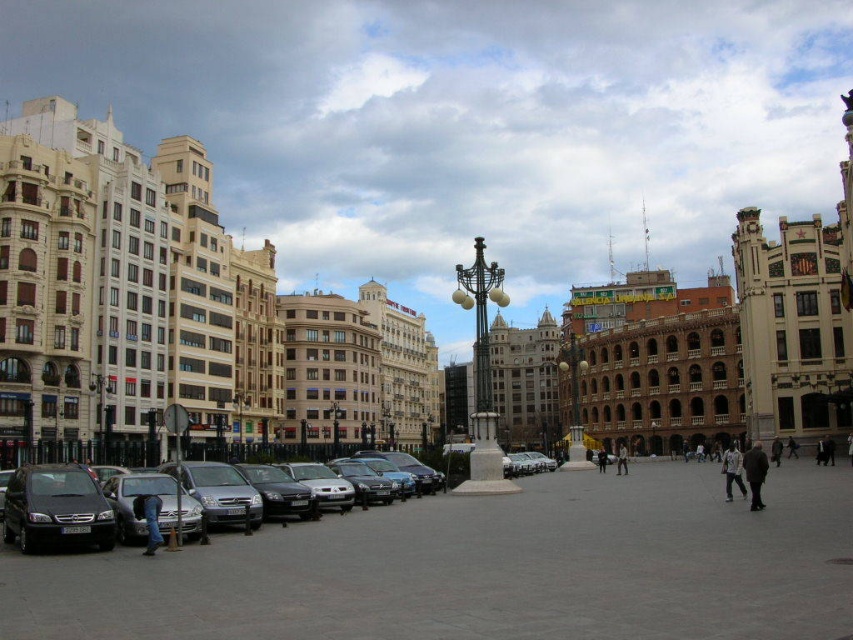
Question: Is matte black car at left positioned in front of dark gray jacket at center?

Choices:
 (A) yes
 (B) no

Answer: (A)

Question: Which point is farther to the camera?

Choices:
 (A) white cotton jacket at lower right
 (B) matte black car at left
 (C) dark gray coat at center right

Answer: (C)

Question: Which point appears farthest from the camera in this image?

Choices:
 (A) (599, 472)
 (B) (33, 522)

Answer: (A)

Question: Can you confirm if dark gray coat at lower right is bigger than dark gray coat at center right?

Choices:
 (A) yes
 (B) no

Answer: (A)

Question: Estimate the real-world distances between objects in this image. Which object is closer to the dark gray coat at lower right?

Choices:
 (A) matte black car at left
 (B) black leather jacket at center
 (C) dark gray coat at center right

Answer: (C)

Question: Does dark gray jacket at center have a greater width compared to black leather jacket at center?

Choices:
 (A) no
 (B) yes

Answer: (B)